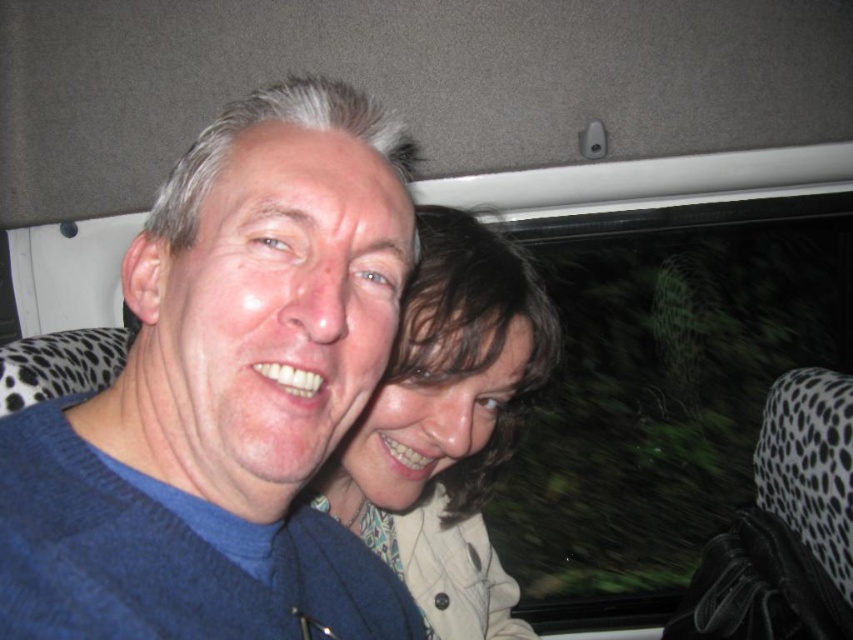
Is light brown textured hair at center bigger than black dotted fabric at right?

Yes, light brown textured hair at center is bigger than black dotted fabric at right.

Is point (537, 381) farther from camera compared to point (776, 554)?

No.

Which is in front, point (421, 460) or point (827, 429)?

Point (421, 460) is in front.

At what (x,y) coordinates should I click in order to perform the action: click on light brown textured hair at center. Please return your answer as a coordinate pair (x, y). The image size is (853, 640). Looking at the image, I should click on (447, 426).

Does blue knitted sweater at center have a smaller size compared to light brown textured hair at center?

Indeed, blue knitted sweater at center has a smaller size compared to light brown textured hair at center.

Measure the distance from blue knitted sweater at center to light brown textured hair at center.

A distance of 8.99 inches exists between blue knitted sweater at center and light brown textured hair at center.

Between point (125, 580) and point (354, 509), which one is positioned in front?

Positioned in front is point (125, 580).

Find the location of a particular element. The image size is (853, 640). blue knitted sweater at center is located at coordinates (225, 396).

Does blue knitted sweater at center have a larger size compared to black dotted fabric at right?

No.

Is point (102, 634) farther from camera compared to point (825, 486)?

No, (102, 634) is in front of (825, 486).

You are a GUI agent. You are given a task and a screenshot of the screen. Output one action in this format:
    pyautogui.click(x=<x>, y=<y>)
    Task: Click on the blue knitted sweater at center
    
    Given the screenshot: What is the action you would take?
    pyautogui.click(x=225, y=396)